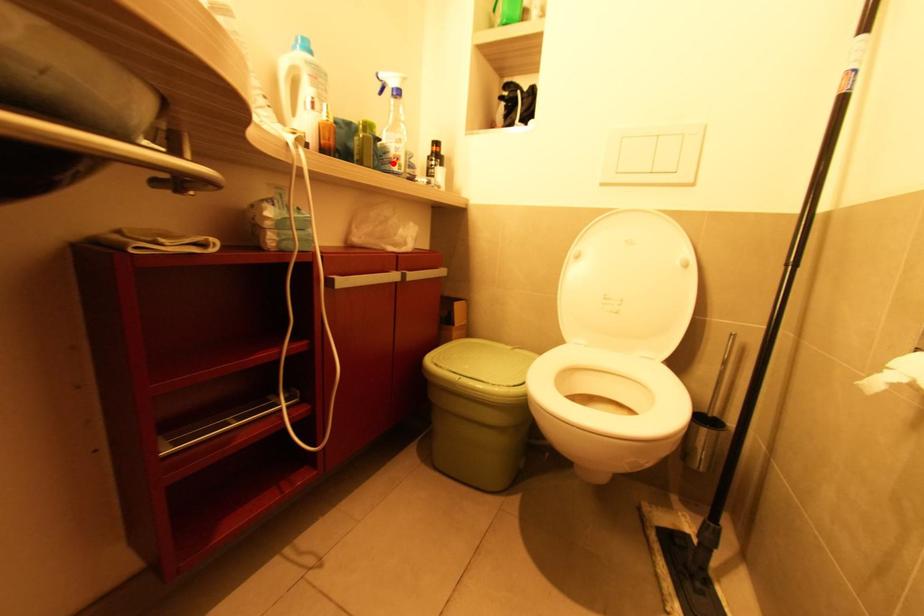
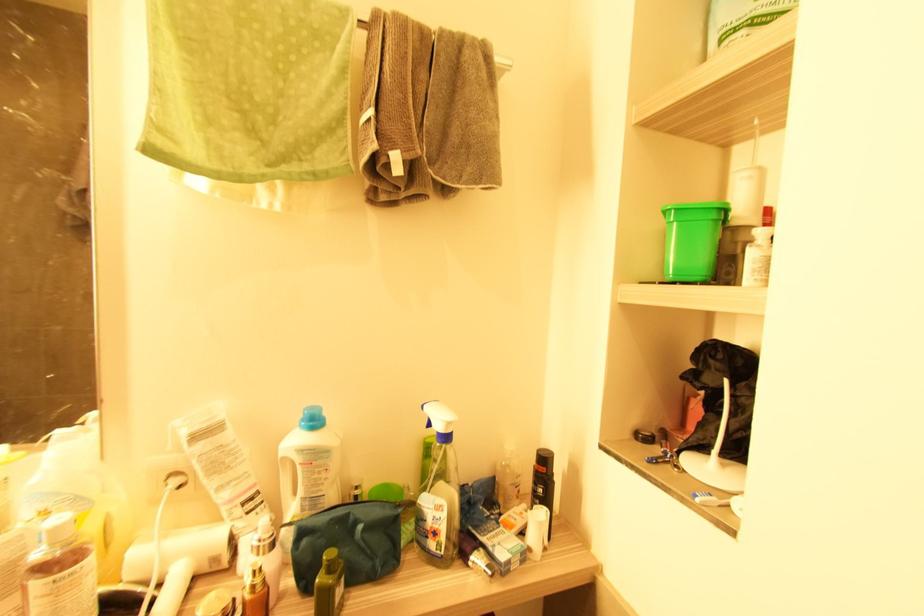
The point at the highlighted location is marked in the first image. Where is the corresponding point in the second image?

(429, 539)